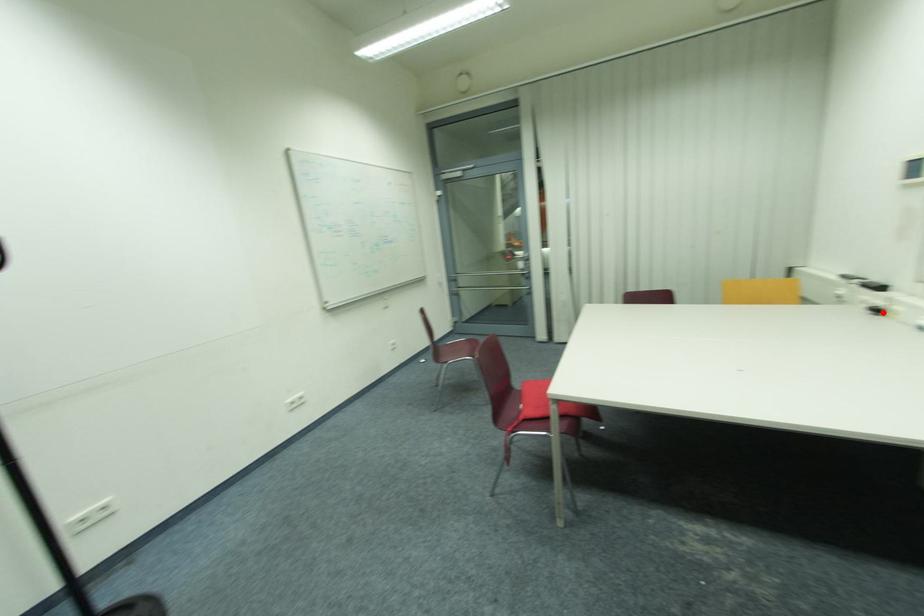
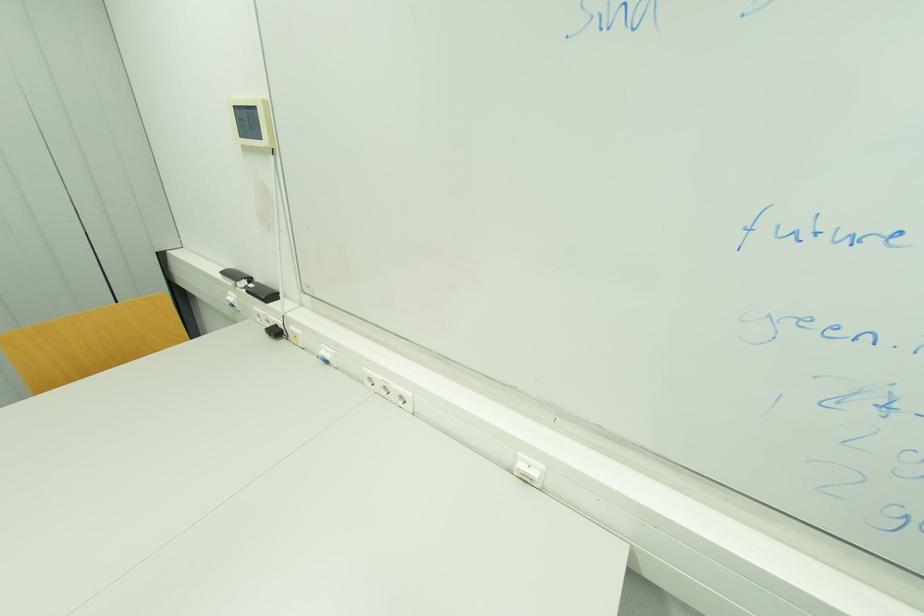
Question: I am providing you with two images of the same scene from different viewpoints. A red point is shown in image1. For the corresponding object point in image2, is it positioned nearer or farther from the camera?

Choices:
 (A) Nearer
 (B) Farther

Answer: (A)